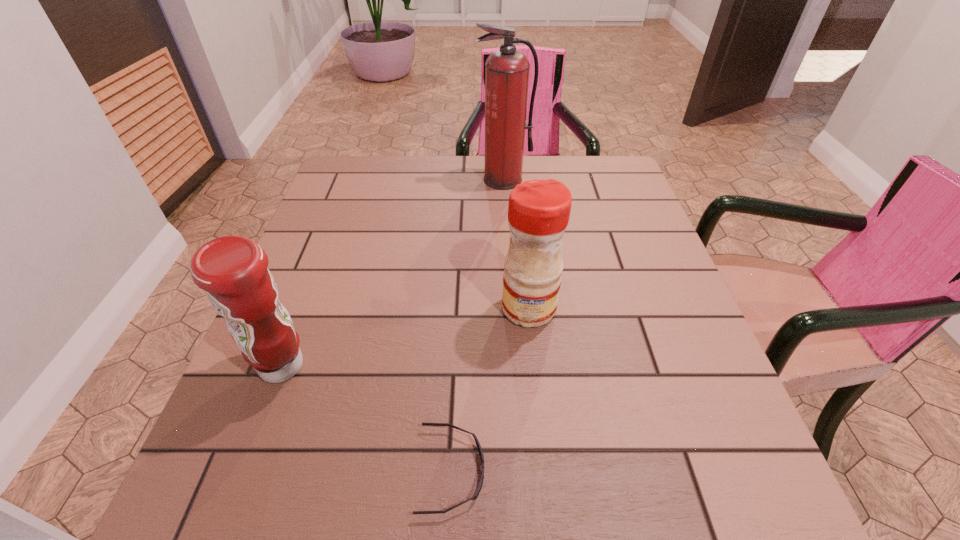
Where is `the farthest object`? the farthest object is located at coordinates (506, 71).

Find the location of a particular element. The height and width of the screenshot is (540, 960). fire extinguisher is located at coordinates (506, 71).

I want to click on the right condiment, so coord(539,210).

Identify the location of the second farthest object. (539, 210).

Find the location of a particular element. The image size is (960, 540). the nearer condiment is located at coordinates (233, 271).

Find the location of a particular element. The image size is (960, 540). the third farthest object is located at coordinates (233, 271).

Image resolution: width=960 pixels, height=540 pixels. What are the coordinates of `the shortest object` in the screenshot? It's located at (480, 484).

Find the location of a particular element. The height and width of the screenshot is (540, 960). sunglasses is located at coordinates (480, 484).

The width and height of the screenshot is (960, 540). In order to click on free region located at the nozzle of the tallest object in this screenshot , I will do `click(512, 296)`.

Identify the location of vacant area situated on the left of the right condiment. (344, 308).